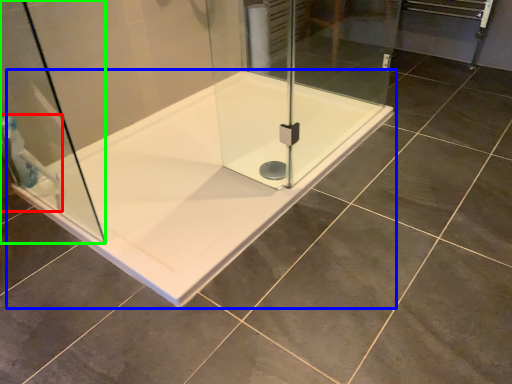
Question: Based on their relative distances, which object is farther from shower (highlighted by a red box)? Choose from bathtub (highlighted by a blue box) and shower door (highlighted by a green box).

Choices:
 (A) bathtub
 (B) shower door

Answer: (A)